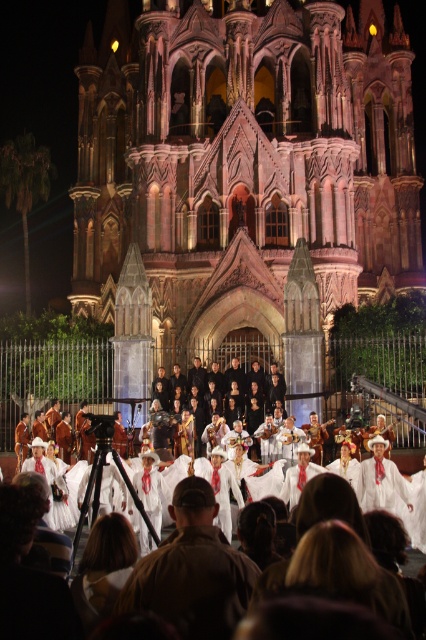
Question: Can you confirm if pink stone church at center is positioned to the right of white cotton dress at center?

Choices:
 (A) no
 (B) yes

Answer: (B)

Question: Which object appears closest to the camera in this image?

Choices:
 (A) pink stone church at center
 (B) white cotton dress at center

Answer: (B)

Question: Is pink stone church at center above white cotton dress at center?

Choices:
 (A) yes
 (B) no

Answer: (A)

Question: Is pink stone church at center to the right of white cotton dress at center from the viewer's perspective?

Choices:
 (A) yes
 (B) no

Answer: (A)